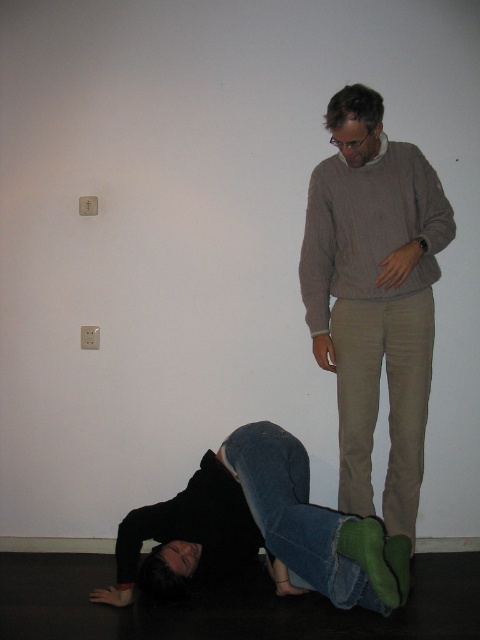
Based on the coordinates provided, which object corresponds to the point (374, 296)?

The light brown sweater at center corresponds to the point (374, 296).